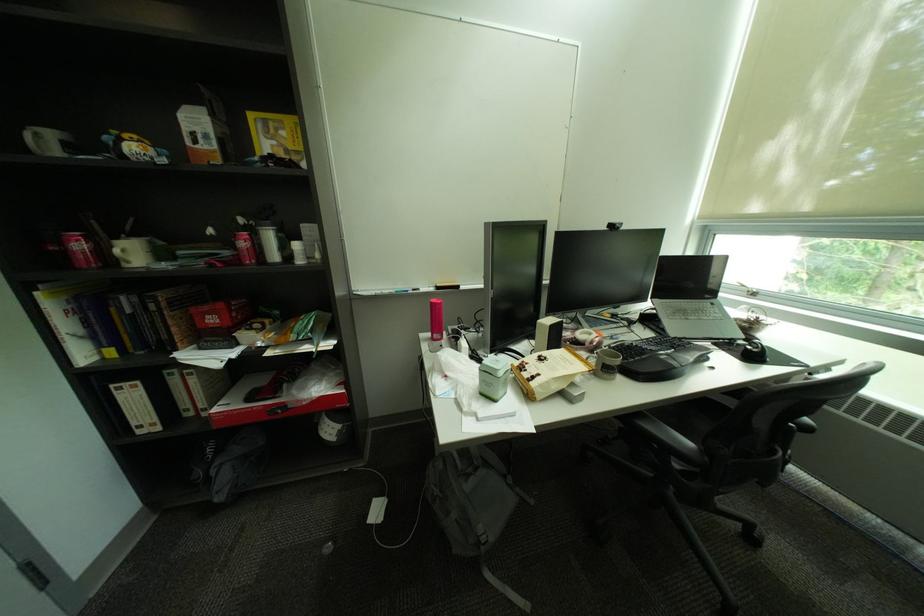
Where would you rest the chair armrest? Please return your answer as a coordinate pair (x, y).

(664, 437)